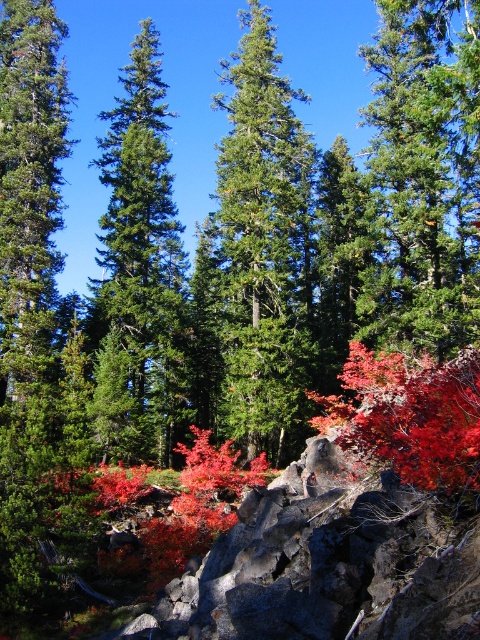
Question: Is green needle-like at center to the right of green glossy pine tree at center from the viewer's perspective?

Choices:
 (A) no
 (B) yes

Answer: (B)

Question: Which object is the farthest from the green matte evergreen tree at center?

Choices:
 (A) green glossy pine tree at center
 (B) green needle-like at center

Answer: (B)

Question: Does green needle-like at center appear on the left side of green glossy pine tree at center?

Choices:
 (A) yes
 (B) no

Answer: (B)

Question: Is green needle-like at center bigger than green glossy pine tree at center?

Choices:
 (A) yes
 (B) no

Answer: (A)

Question: Based on their relative distances, which object is nearer to the green needle-like at center?

Choices:
 (A) green glossy pine tree at center
 (B) green matte evergreen tree at center

Answer: (B)

Question: Which point is farther to the camera?

Choices:
 (A) (414, 51)
 (B) (130, 262)

Answer: (A)